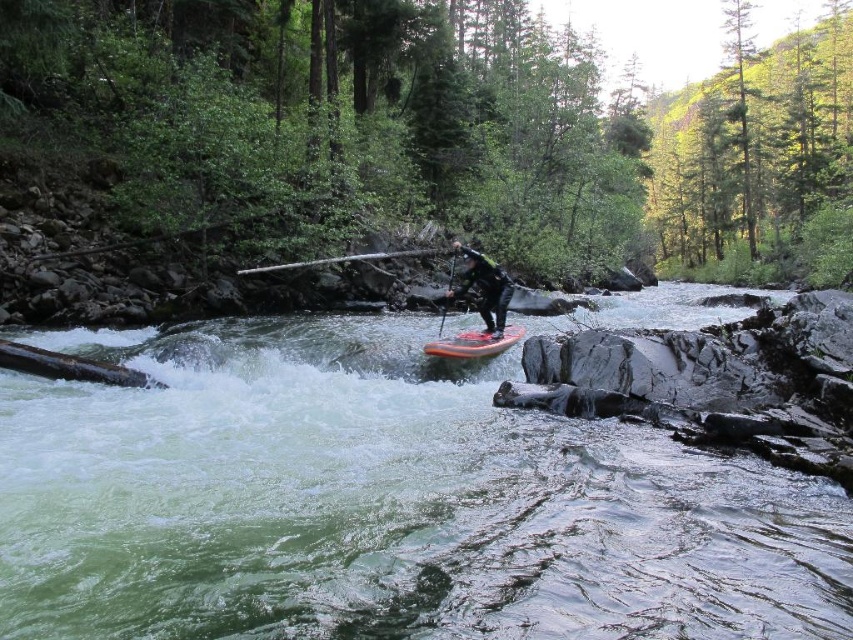
Question: Does black rubber wetsuit at center lie behind smooth orange paddle at center?

Choices:
 (A) no
 (B) yes

Answer: (A)

Question: Among these objects, which one is nearest to the camera?

Choices:
 (A) smooth wooden paddle at center
 (B) smooth orange paddle at center

Answer: (B)

Question: Is orange glossy canoe at center wider than smooth orange paddle at center?

Choices:
 (A) yes
 (B) no

Answer: (A)

Question: Is orange glossy canoe at center smaller than smooth wooden paddle at center?

Choices:
 (A) no
 (B) yes

Answer: (B)

Question: Which of these objects is positioned farthest from the white frothy water at center?

Choices:
 (A) black rubber wetsuit at center
 (B) orange glossy canoe at center
 (C) smooth orange paddle at center
 (D) smooth wooden paddle at center

Answer: (D)

Question: Which object is closer to the camera taking this photo?

Choices:
 (A) orange glossy canoe at center
 (B) smooth orange paddle at center

Answer: (A)